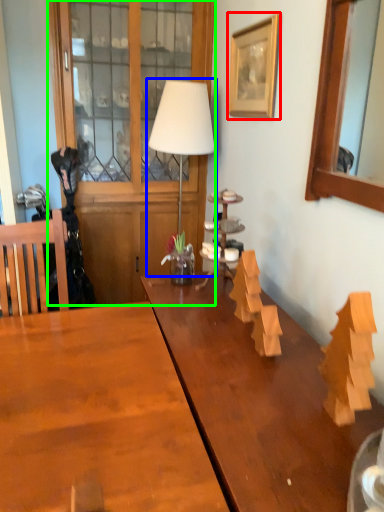
Question: Based on their relative distances, which object is nearer to picture frame (highlighted by a red box)? Choose from table lamp (highlighted by a blue box) and dresser (highlighted by a green box).

Choices:
 (A) table lamp
 (B) dresser

Answer: (A)